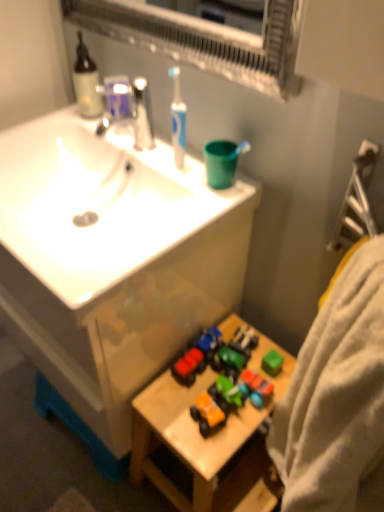
I want to click on unoccupied area in front of translucent glass soap dispenser at upper left, so coord(107,129).